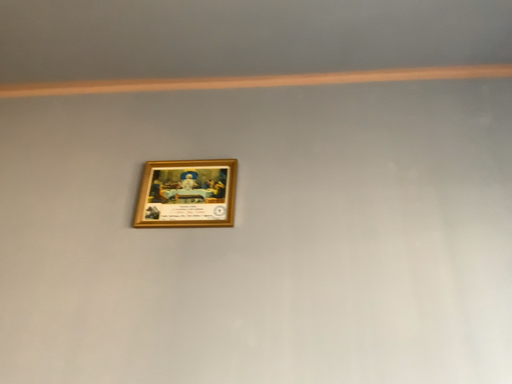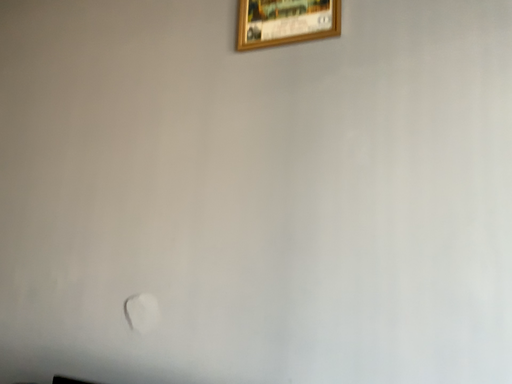
Question: How did the camera likely rotate when shooting the video?

Choices:
 (A) rotated downward
 (B) rotated upward

Answer: (A)